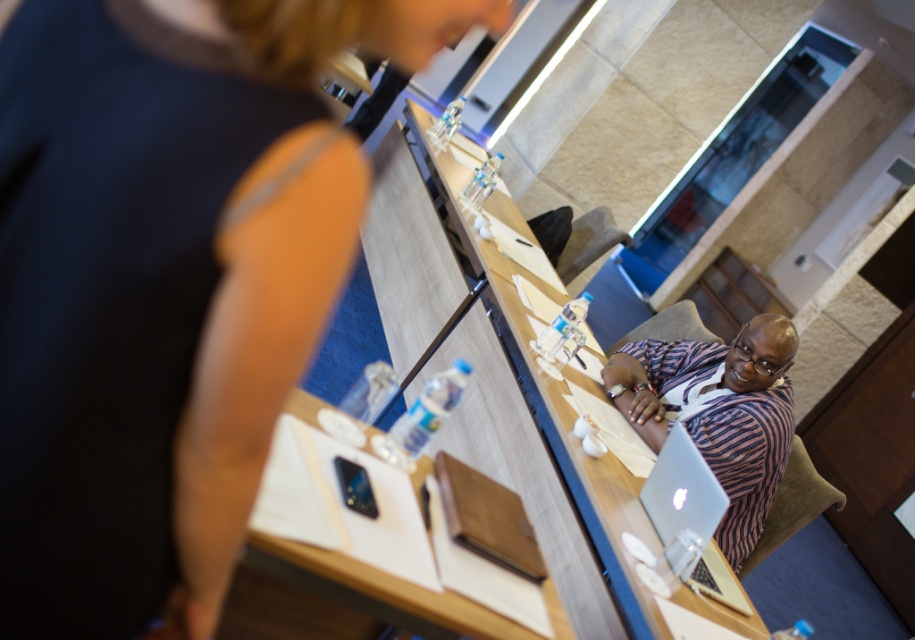
Is point (748, 410) behind point (693, 529)?

Yes, point (748, 410) is behind point (693, 529).

Between striped fabric shirt at center and silver metallic laptop at center, which one has more height?

striped fabric shirt at center

The image size is (915, 640). In order to click on striped fabric shirt at center in this screenshot , I will do `click(718, 412)`.

Is wooden table at center below striped fabric shirt at center?

No, wooden table at center is not below striped fabric shirt at center.

Between point (585, 474) and point (729, 355), which one is positioned behind?

The point (729, 355) is behind.

Where is `wooden table at center`? The image size is (915, 640). wooden table at center is located at coordinates (558, 422).

Is matte black shirt at upper left below striped fabric shirt at center?

Incorrect, matte black shirt at upper left is not positioned below striped fabric shirt at center.

From the picture: Who is shorter, matte black shirt at upper left or striped fabric shirt at center?

matte black shirt at upper left

The height and width of the screenshot is (640, 915). What are the coordinates of `matte black shirt at upper left` in the screenshot? It's located at (165, 280).